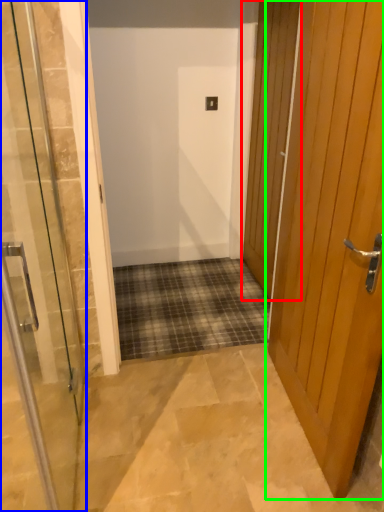
Question: Which is farther away from door (highlighted by a red box)? door (highlighted by a blue box) or door (highlighted by a green box)?

Choices:
 (A) door
 (B) door

Answer: (A)